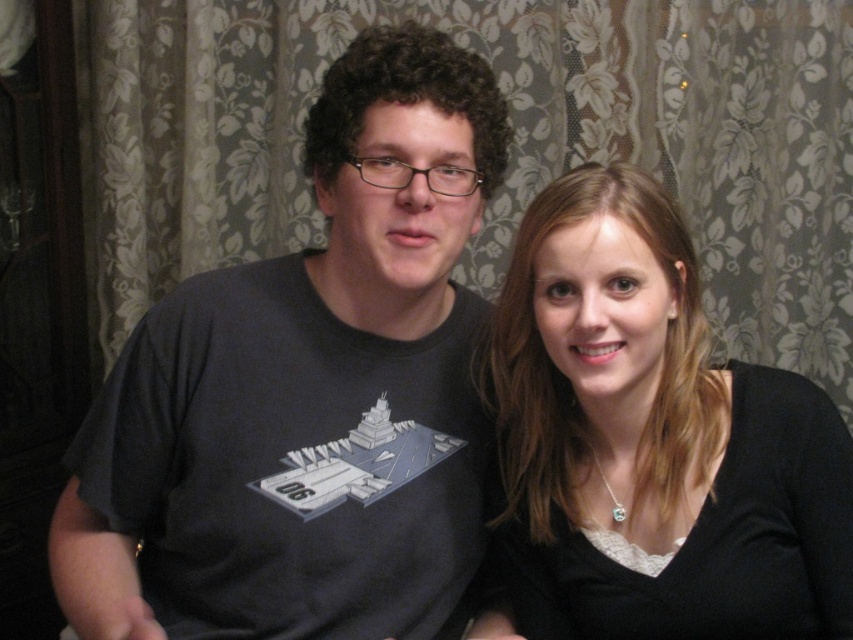
Describe the element at coordinates (311, 396) in the screenshot. I see `dark gray t-shirt at center` at that location.

Is dark gray t-shirt at center bigger than black matte shirt at right?

Yes, dark gray t-shirt at center is bigger than black matte shirt at right.

Does point (177, 304) come closer to viewer compared to point (795, 586)?

No, (177, 304) is further to viewer.

I want to click on dark gray t-shirt at center, so click(311, 396).